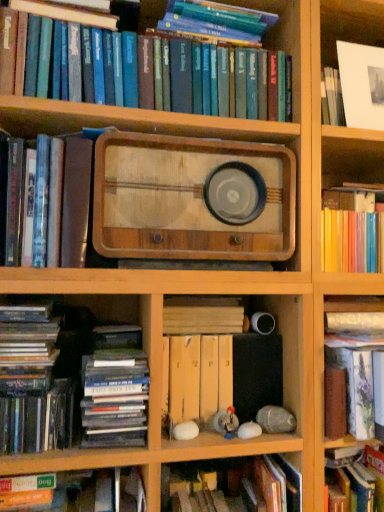
Question: From the image's perspective, is yellow cardboard file at center, which is the 6th book in top-to-bottom order, beneath hardcover books at upper center, which is the first book in top-to-bottom order?

Choices:
 (A) no
 (B) yes

Answer: (B)

Question: Is yellow cardboard file at center, which is the 6th book in top-to-bottom order, behind hardcover books at upper center, placed as the ninth book when sorted from bottom to top?

Choices:
 (A) yes
 (B) no

Answer: (A)

Question: Are yellow cardboard file at center, the fourth book when ordered from bottom to top, and hardcover books at upper center, which is the first book in top-to-bottom order, far apart?

Choices:
 (A) yes
 (B) no

Answer: (B)

Question: From the image's perspective, is yellow cardboard file at center, which is the 6th book in top-to-bottom order, on hardcover books at upper center, which is the first book in top-to-bottom order?

Choices:
 (A) yes
 (B) no

Answer: (B)

Question: Can you confirm if yellow cardboard file at center, which is the 6th book in top-to-bottom order, is positioned to the right of hardcover books at upper center, which is the first book in top-to-bottom order?

Choices:
 (A) no
 (B) yes

Answer: (B)

Question: Would you say yellow cardboard file at center, which is the 6th book in top-to-bottom order, is inside or outside white matte egg at lower center, marked as the ninth book in a top-to-bottom arrangement?

Choices:
 (A) outside
 (B) inside

Answer: (A)

Question: Is yellow cardboard file at center, the fourth book when ordered from bottom to top, taller or shorter than white matte egg at lower center, marked as the ninth book in a top-to-bottom arrangement?

Choices:
 (A) short
 (B) tall

Answer: (A)

Question: Is yellow cardboard file at center, the fourth book when ordered from bottom to top, in front of or behind white matte egg at lower center, marked as the ninth book in a top-to-bottom arrangement, in the image?

Choices:
 (A) behind
 (B) front

Answer: (A)

Question: Would you say yellow cardboard file at center, which is the 6th book in top-to-bottom order, is to the left or to the right of white matte egg at lower center, marked as the ninth book in a top-to-bottom arrangement, in the picture?

Choices:
 (A) right
 (B) left

Answer: (B)

Question: From the image's perspective, relative to matte black cd at lower left, arranged as the 5th book when ordered from the bottom, is hardcover book at left, the 3th book from the bottom, above or below?

Choices:
 (A) above
 (B) below

Answer: (B)

Question: In the image, is hardcover book at left, arranged as the 7th book when viewed from the top, positioned in front of or behind matte black cd at lower left, arranged as the 5th book when ordered from the bottom?

Choices:
 (A) behind
 (B) front

Answer: (B)

Question: Is hardcover book at left, the 3th book from the bottom, situated inside matte black cd at lower left, arranged as the 5th book when ordered from the bottom, or outside?

Choices:
 (A) inside
 (B) outside

Answer: (B)

Question: In terms of height, does hardcover book at left, the 3th book from the bottom, look taller or shorter compared to matte black cd at lower left, which appears as the fifth book when viewed from the top?

Choices:
 (A) short
 (B) tall

Answer: (A)

Question: Is matte black book at lower left, which is the 4th book from top to bottom, taller or shorter than yellow cardboard file at center, which is the 6th book in top-to-bottom order?

Choices:
 (A) tall
 (B) short

Answer: (B)

Question: From a real-world perspective, is matte black book at lower left, which is the 4th book from top to bottom, physically located above or below yellow cardboard file at center, the fourth book when ordered from bottom to top?

Choices:
 (A) below
 (B) above

Answer: (B)